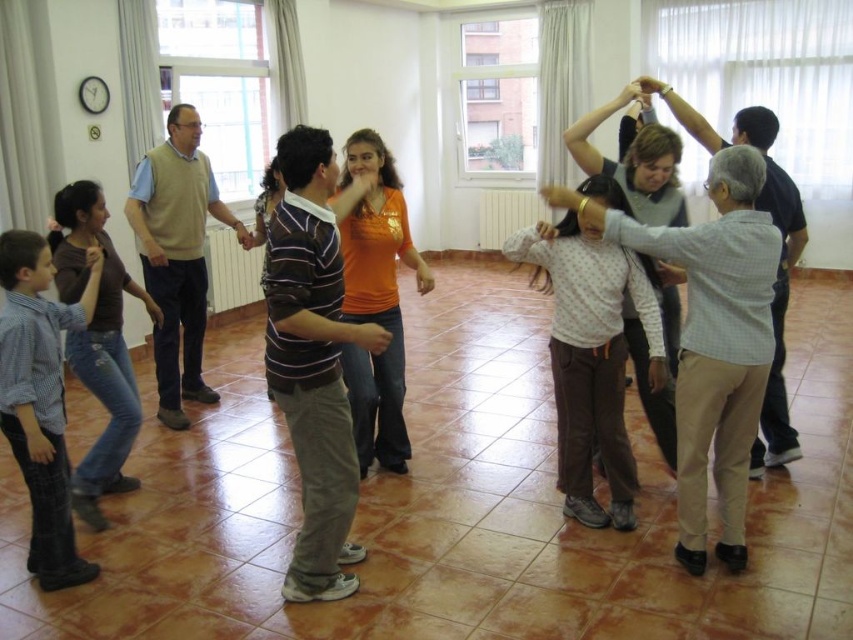
How distant is beige sweater at center from checkered fabric shirt at upper right?

beige sweater at center is 2.87 meters from checkered fabric shirt at upper right.

Does point (202, 186) lie in front of point (740, 109)?

Yes, point (202, 186) is closer to viewer.

Identify the location of beige sweater at center. This screenshot has height=640, width=853. (177, 256).